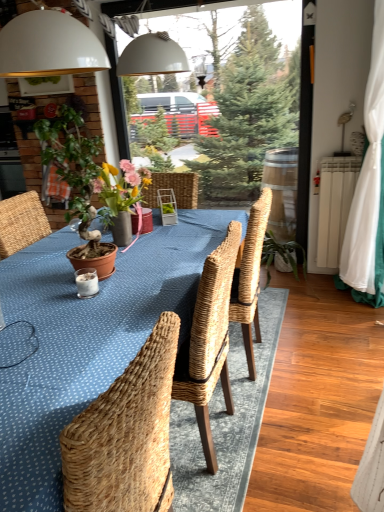
Question: Is point (347, 251) closer or farther from the camera than point (28, 443)?

Choices:
 (A) closer
 (B) farther

Answer: (B)

Question: From the image's perspective, is white fabric curtain at right above or below blue woven table at center?

Choices:
 (A) below
 (B) above

Answer: (B)

Question: Which is farther from the blue woven table at center?

Choices:
 (A) white fabric curtain at right
 (B) terracotta pot at left

Answer: (A)

Question: Considering the real-world distances, which object is closest to the blue woven table at center?

Choices:
 (A) terracotta pot at left
 (B) white fabric curtain at right

Answer: (A)